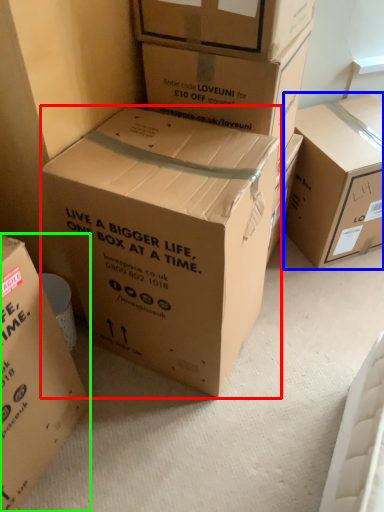
Question: Which object is the farthest from box (highlighted by a red box)? Choose among these: box (highlighted by a blue box) or box (highlighted by a green box).

Choices:
 (A) box
 (B) box

Answer: (A)